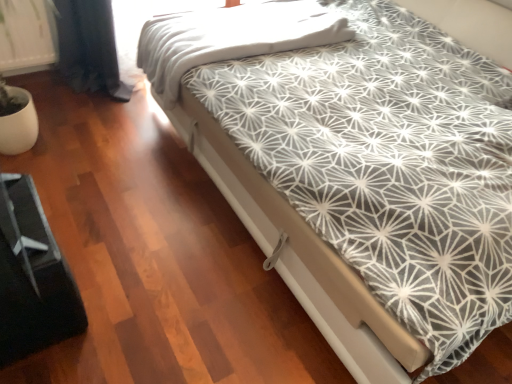
Question: Does black plastic bed frame at lower left lie behind white geometric-patterned bed at center?

Choices:
 (A) no
 (B) yes

Answer: (B)

Question: Is black plastic bed frame at lower left surrounding white geometric-patterned bed at center?

Choices:
 (A) yes
 (B) no

Answer: (B)

Question: Does black plastic bed frame at lower left have a larger size compared to white geometric-patterned bed at center?

Choices:
 (A) no
 (B) yes

Answer: (A)

Question: From a real-world perspective, does black plastic bed frame at lower left sit lower than white geometric-patterned bed at center?

Choices:
 (A) yes
 (B) no

Answer: (A)

Question: From the image's perspective, is black plastic bed frame at lower left over white geometric-patterned bed at center?

Choices:
 (A) yes
 (B) no

Answer: (B)

Question: Looking at their shapes, would you say white geometric-patterned bed at center is wider or thinner than black plastic bed frame at lower left?

Choices:
 (A) wide
 (B) thin

Answer: (A)

Question: In the image, is white geometric-patterned bed at center positioned in front of or behind black plastic bed frame at lower left?

Choices:
 (A) front
 (B) behind

Answer: (A)

Question: From the image's perspective, is white geometric-patterned bed at center positioned above or below black plastic bed frame at lower left?

Choices:
 (A) below
 (B) above

Answer: (B)

Question: Is white geometric-patterned bed at center bigger or smaller than black plastic bed frame at lower left?

Choices:
 (A) big
 (B) small

Answer: (A)

Question: In terms of width, does black plastic bed frame at lower left look wider or thinner when compared to white geometric-patterned bed at center?

Choices:
 (A) thin
 (B) wide

Answer: (A)

Question: Is black plastic bed frame at lower left to the left or to the right of white geometric-patterned bed at center in the image?

Choices:
 (A) left
 (B) right

Answer: (A)

Question: From the image's perspective, relative to white geometric-patterned bed at center, is black plastic bed frame at lower left above or below?

Choices:
 (A) below
 (B) above

Answer: (A)

Question: Is black plastic bed frame at lower left bigger or smaller than white geometric-patterned bed at center?

Choices:
 (A) small
 (B) big

Answer: (A)

Question: From the image's perspective, is white textured blanket at upper center located above or below white geometric-patterned bed at center?

Choices:
 (A) above
 (B) below

Answer: (A)

Question: Would you say white textured blanket at upper center is to the left or to the right of white geometric-patterned bed at center in the picture?

Choices:
 (A) right
 (B) left

Answer: (B)